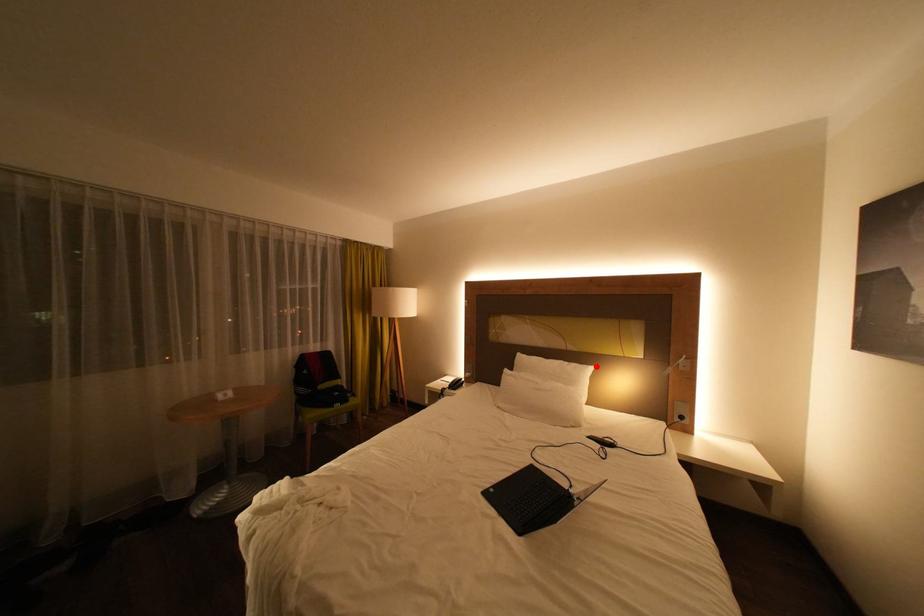
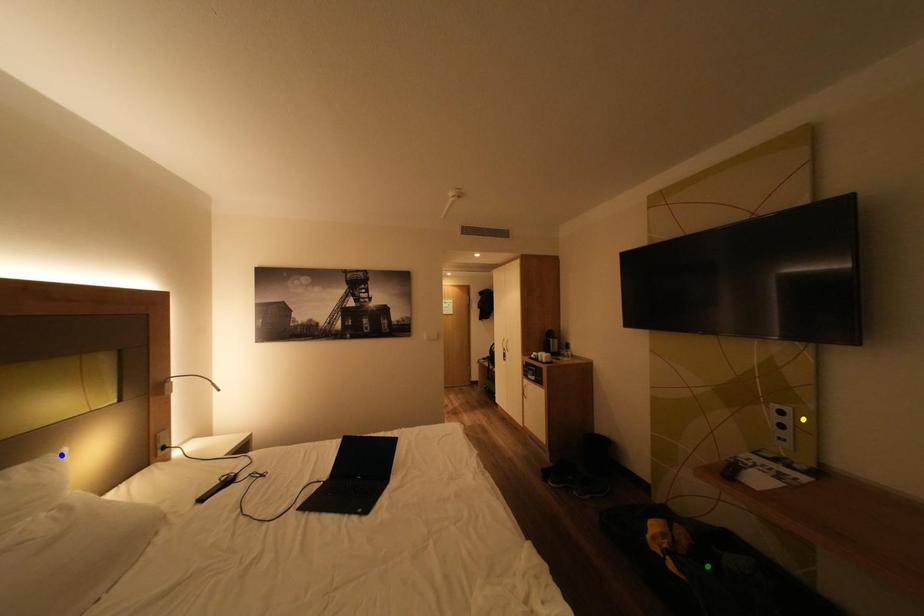
Question: I am providing you with two images of the same scene from different viewpoints. A red point is marked on the first image. You are given multiple points on the second image. Can you choose the point in image 2 that corresponds to the point in image 1?

Choices:
 (A) blue point
 (B) green point
 (C) yellow point

Answer: (A)